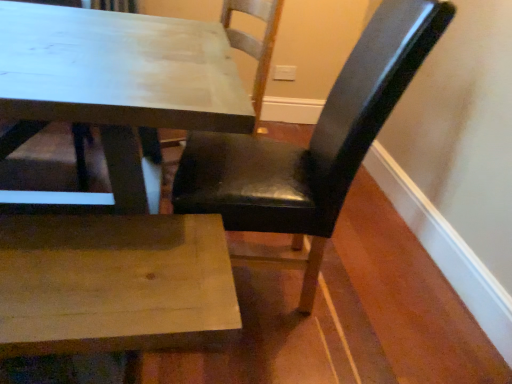
What do you see at coordinates (124, 89) in the screenshot? I see `black leather chair at upper right, which is counted as the first chair, starting from the left` at bounding box center [124, 89].

Identify the location of black leather chair at upper right, which is counted as the first chair, starting from the left. click(124, 89).

From the picture: What is the approximate width of black leather chair at upper right, which is counted as the first chair, starting from the left?

black leather chair at upper right, which is counted as the first chair, starting from the left, is 1.02 meters wide.

What is the approximate height of black leather chair at center, the second chair in the left-to-right sequence?

black leather chair at center, the second chair in the left-to-right sequence, is 3.45 feet in height.

What do you see at coordinates (312, 142) in the screenshot?
I see `black leather chair at center, the 1th chair viewed from the right` at bounding box center [312, 142].

At what (x,y) coordinates should I click in order to perform the action: click on black leather chair at center, the 1th chair viewed from the right. Please return your answer as a coordinate pair (x, y). Looking at the image, I should click on (312, 142).

Image resolution: width=512 pixels, height=384 pixels. What are the coordinates of `black leather chair at upper right, which is counted as the first chair, starting from the left` in the screenshot? It's located at (124, 89).

Would you say black leather chair at center, the 1th chair viewed from the right, is to the left or to the right of black leather chair at upper right, which is counted as the first chair, starting from the left, in the picture?

Clearly, black leather chair at center, the 1th chair viewed from the right, is on the right of black leather chair at upper right, which is counted as the first chair, starting from the left, in the image.

In the image, is black leather chair at center, the 1th chair viewed from the right, positioned in front of or behind black leather chair at upper right, which is counted as the first chair, starting from the left?

In the image, black leather chair at center, the 1th chair viewed from the right, appears in front of black leather chair at upper right, which is counted as the first chair, starting from the left.

Is point (432, 13) closer or farther from the camera than point (265, 72)?

Point (432, 13) is positioned closer to the camera compared to point (265, 72).

From the image's perspective, who appears lower, black leather chair at center, the second chair in the left-to-right sequence, or black leather chair at upper right, which is counted as the first chair, starting from the left?

black leather chair at center, the second chair in the left-to-right sequence, is shown below in the image.

From a real-world perspective, is black leather chair at center, the 1th chair viewed from the right, physically above black leather chair at upper right, the second chair in the right-to-left sequence?

Yes, from a real-world perspective, black leather chair at center, the 1th chair viewed from the right, is above black leather chair at upper right, the second chair in the right-to-left sequence.

Considering the sizes of objects black leather chair at center, the second chair in the left-to-right sequence, and black leather chair at upper right, which is counted as the first chair, starting from the left, in the image provided, who is wider, black leather chair at center, the second chair in the left-to-right sequence, or black leather chair at upper right, which is counted as the first chair, starting from the left,?

Wider between the two is black leather chair at upper right, which is counted as the first chair, starting from the left.

Considering the sizes of objects black leather chair at center, the 1th chair viewed from the right, and black leather chair at upper right, the second chair in the right-to-left sequence, in the image provided, who is shorter, black leather chair at center, the 1th chair viewed from the right, or black leather chair at upper right, the second chair in the right-to-left sequence,?

black leather chair at upper right, the second chair in the right-to-left sequence, is shorter.

Does black leather chair at center, the 1th chair viewed from the right, have a smaller size compared to black leather chair at upper right, the second chair in the right-to-left sequence?

Correct, black leather chair at center, the 1th chair viewed from the right, occupies less space than black leather chair at upper right, the second chair in the right-to-left sequence.

Is black leather chair at center, the 1th chair viewed from the right, inside or outside of black leather chair at upper right, which is counted as the first chair, starting from the left?

black leather chair at center, the 1th chair viewed from the right, is not inside black leather chair at upper right, which is counted as the first chair, starting from the left, it's outside.

In the scene shown: Is there a large distance between black leather chair at center, the 1th chair viewed from the right, and black leather chair at upper right, which is counted as the first chair, starting from the left?

black leather chair at center, the 1th chair viewed from the right, is near black leather chair at upper right, which is counted as the first chair, starting from the left, not far away.

Is black leather chair at center, the 1th chair viewed from the right, oriented away from black leather chair at upper right, which is counted as the first chair, starting from the left?

No, black leather chair at center, the 1th chair viewed from the right,'s orientation is not away from black leather chair at upper right, which is counted as the first chair, starting from the left.

How many degrees apart are the facing directions of black leather chair at center, the 1th chair viewed from the right, and black leather chair at upper right, which is counted as the first chair, starting from the left?

The angular difference between black leather chair at center, the 1th chair viewed from the right, and black leather chair at upper right, which is counted as the first chair, starting from the left, is 91.9 degrees.

I want to click on chair above the black leather chair at upper right, the second chair in the right-to-left sequence (from a real-world perspective), so click(312, 142).

Does black leather chair at upper right, which is counted as the first chair, starting from the left, appear on the left side of black leather chair at center, the second chair in the left-to-right sequence?

Indeed, black leather chair at upper right, which is counted as the first chair, starting from the left, is positioned on the left side of black leather chair at center, the second chair in the left-to-right sequence.

Considering the relative positions of black leather chair at upper right, which is counted as the first chair, starting from the left, and black leather chair at center, the 1th chair viewed from the right, in the image provided, is black leather chair at upper right, which is counted as the first chair, starting from the left, in front of black leather chair at center, the 1th chair viewed from the right,?

No, it is not.

Which is nearer, (200, 67) or (331, 96)?

Point (331, 96)

From the image's perspective, between black leather chair at upper right, which is counted as the first chair, starting from the left, and black leather chair at center, the 1th chair viewed from the right, who is located below?

From the image's view, black leather chair at center, the 1th chair viewed from the right, is below.

From a real-world perspective, is black leather chair at upper right, which is counted as the first chair, starting from the left, below black leather chair at center, the second chair in the left-to-right sequence?

Yes, from a real-world perspective, black leather chair at upper right, which is counted as the first chair, starting from the left, is under black leather chair at center, the second chair in the left-to-right sequence.

Looking at their sizes, would you say black leather chair at upper right, the second chair in the right-to-left sequence, is wider or thinner than black leather chair at center, the 1th chair viewed from the right?

black leather chair at upper right, the second chair in the right-to-left sequence, is wider than black leather chair at center, the 1th chair viewed from the right.

Can you confirm if black leather chair at upper right, which is counted as the first chair, starting from the left, is shorter than black leather chair at center, the second chair in the left-to-right sequence?

Correct, black leather chair at upper right, which is counted as the first chair, starting from the left, is not as tall as black leather chair at center, the second chair in the left-to-right sequence.

Based on their sizes in the image, would you say black leather chair at upper right, the second chair in the right-to-left sequence, is bigger or smaller than black leather chair at center, the 1th chair viewed from the right?

In the image, black leather chair at upper right, the second chair in the right-to-left sequence, appears to be larger than black leather chair at center, the 1th chair viewed from the right.

Is black leather chair at upper right, which is counted as the first chair, starting from the left, not within black leather chair at center, the 1th chair viewed from the right?

Yes, black leather chair at upper right, which is counted as the first chair, starting from the left, is located beyond the bounds of black leather chair at center, the 1th chair viewed from the right.

Is the surface of black leather chair at upper right, the second chair in the right-to-left sequence, in direct contact with black leather chair at center, the 1th chair viewed from the right?

No, black leather chair at upper right, the second chair in the right-to-left sequence, is not next to black leather chair at center, the 1th chair viewed from the right.

Is black leather chair at upper right, which is counted as the first chair, starting from the left, turned away from black leather chair at center, the 1th chair viewed from the right?

No, black leather chair at center, the 1th chair viewed from the right, is not at the back of black leather chair at upper right, which is counted as the first chair, starting from the left.

The width and height of the screenshot is (512, 384). I want to click on chair that appears below the black leather chair at upper right, the second chair in the right-to-left sequence (from the image's perspective), so click(312, 142).

You are a GUI agent. You are given a task and a screenshot of the screen. Output one action in this format:
    pyautogui.click(x=<x>, y=<y>)
    Task: Click on the chair to the left of black leather chair at center, the second chair in the left-to-right sequence
    The width and height of the screenshot is (512, 384).
    Given the screenshot: What is the action you would take?
    pyautogui.click(x=124, y=89)

Locate an element on the screen. chair on the right of black leather chair at upper right, the second chair in the right-to-left sequence is located at coordinates (312, 142).